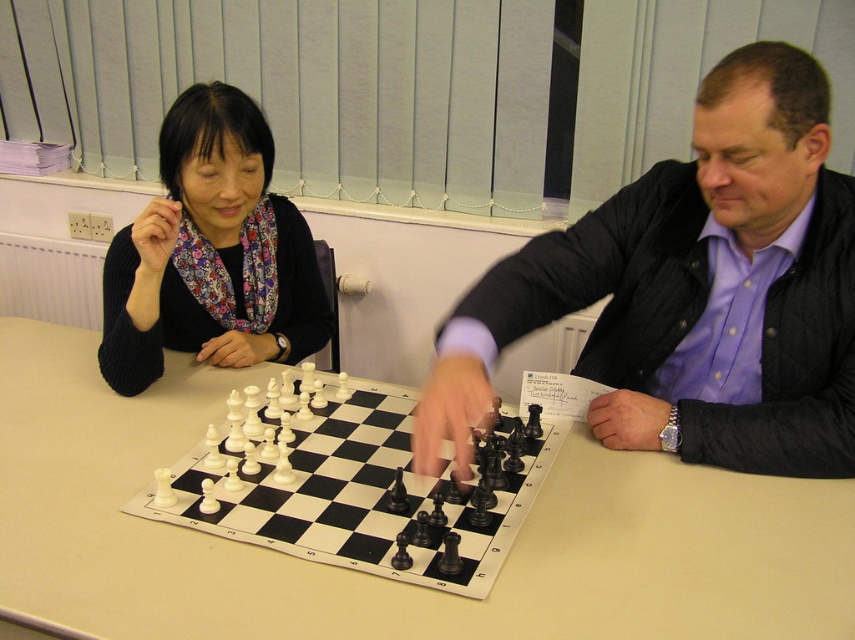
Does white plastic table at center have a lesser width compared to matte black sweater at upper left?

In fact, white plastic table at center might be wider than matte black sweater at upper left.

Between white plastic table at center and matte black sweater at upper left, which one has less height?

white plastic table at center

In order to click on white plastic table at center in this screenshot , I will do `click(384, 579)`.

How much distance is there between white plastic table at center and matte black jacket at center?

white plastic table at center is 35.02 centimeters from matte black jacket at center.

Where is `white plastic table at center`? Image resolution: width=855 pixels, height=640 pixels. white plastic table at center is located at coordinates (384, 579).

Identify the location of white plastic table at center. (384, 579).

Does point (404, 406) come closer to viewer compared to point (121, 323)?

That is False.

Does white plastic chess pieces at center have a greater width compared to matte black sweater at upper left?

Yes, white plastic chess pieces at center is wider than matte black sweater at upper left.

Identify the location of white plastic chess pieces at center. (357, 490).